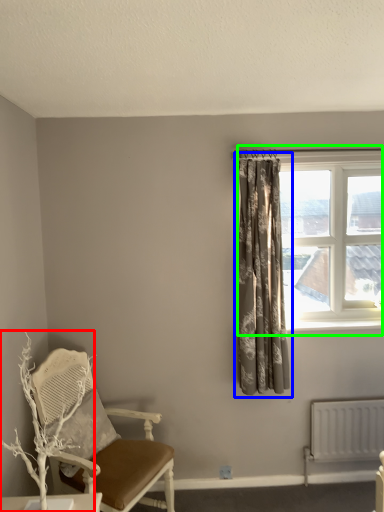
Question: Based on their relative distances, which object is nearer to branch (highlighted by a red box)? Choose from curtain (highlighted by a blue box) and window (highlighted by a green box).

Choices:
 (A) curtain
 (B) window

Answer: (A)